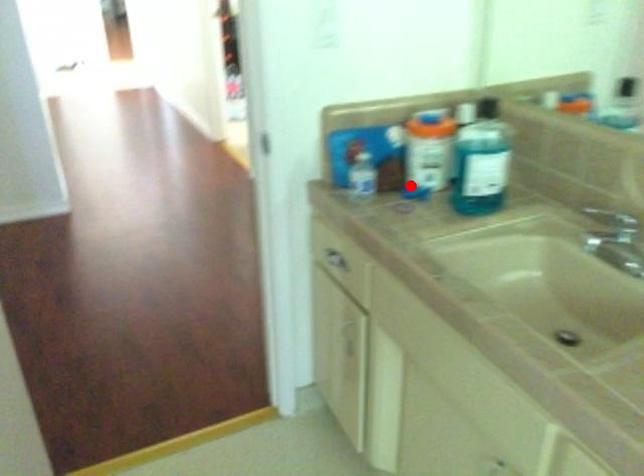
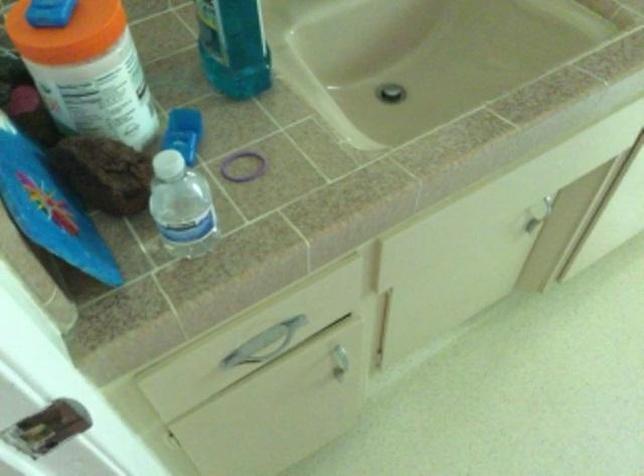
Question: I am providing you with two images of the same scene from different viewpoints. In image1, a red point is highlighted. Considering the same 3D point in image2, which of the following is correct?

Choices:
 (A) It is closer
 (B) It is farther

Answer: (A)